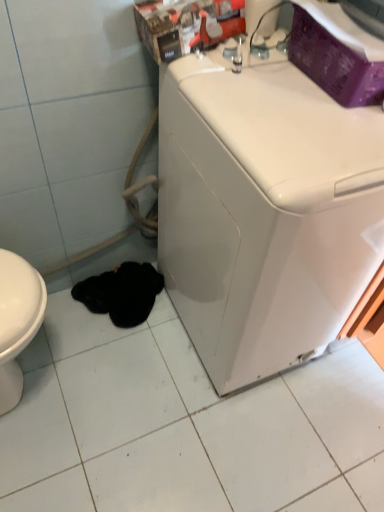
Where is `empty space that is in between white glossy washing machine at center and black soft cloth at lower left`? This screenshot has height=512, width=384. empty space that is in between white glossy washing machine at center and black soft cloth at lower left is located at coordinates (163, 352).